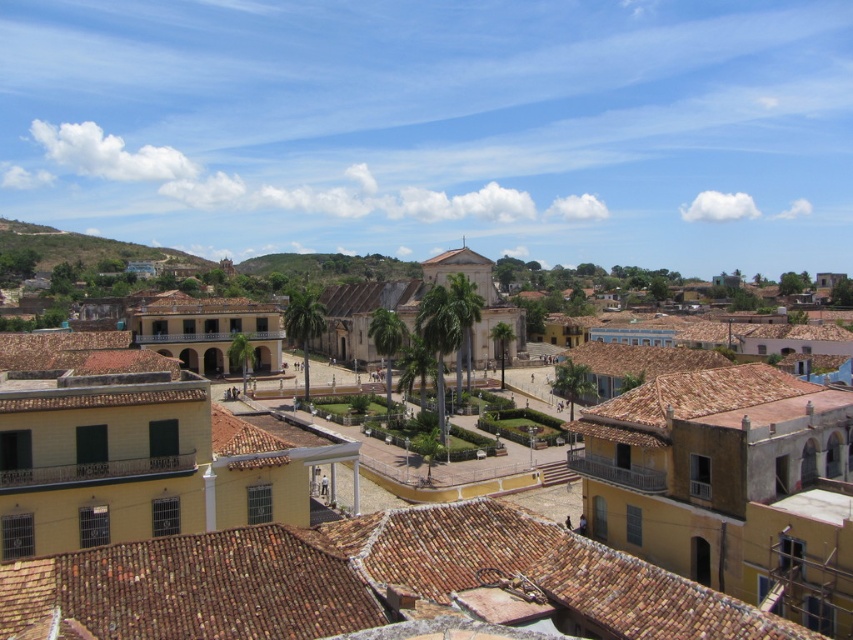
Based on the photo, you are an architect designing a new building in the town square. You need to decide whether to place a large statue between the brown tile roof at lower center and the green grassy hillside at upper left. Based on their widths, which side should the statue be placed closer to?

The brown tile roof at lower center is thinner than the green grassy hillside at upper left, so the statue should be placed closer to the brown tile roof at lower center to maintain balance in the design.

You are planning to install a new solar panel system on the yellow clay roof tiles at center. Considering the width of the roof compared to the green grassy hillside at upper left, will the solar panels fit comfortably without overlapping the edges of the roof?

The yellow clay roof tiles at center has a lesser width compared to the green grassy hillside at upper left, so the solar panels may not fit comfortably without overlapping the edges of the roof due to the narrower width of the roof.